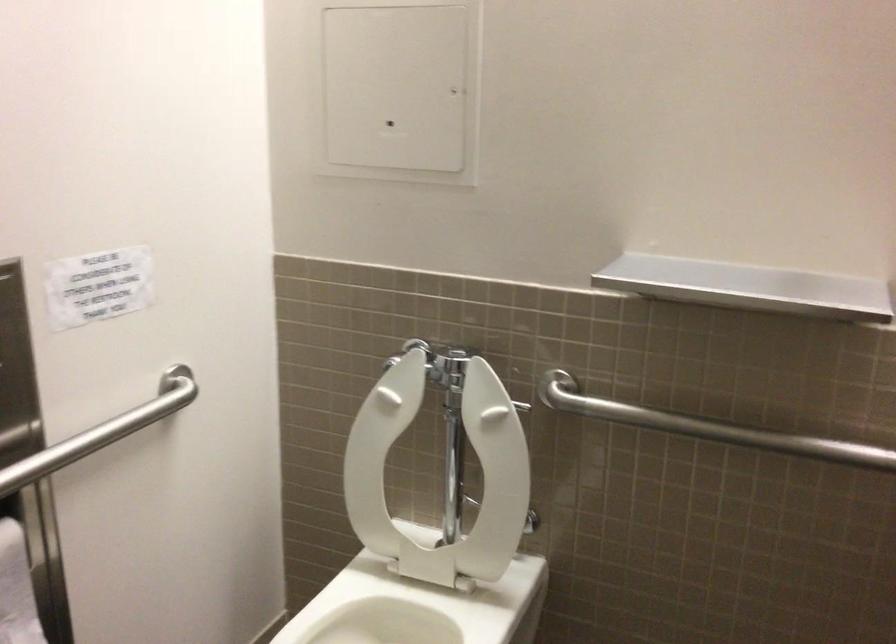
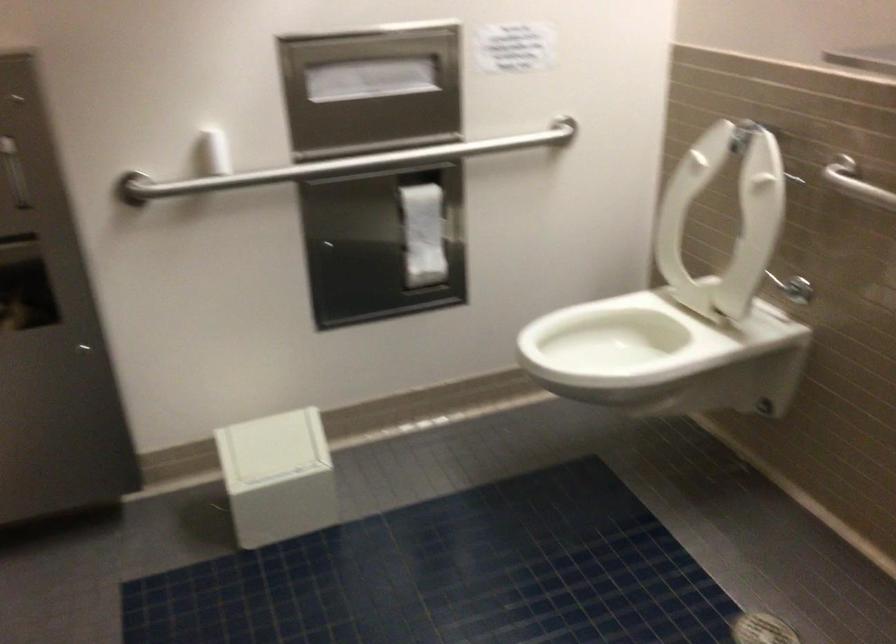
Where in the second image is the point corresponding to (526,523) from the first image?

(793, 288)